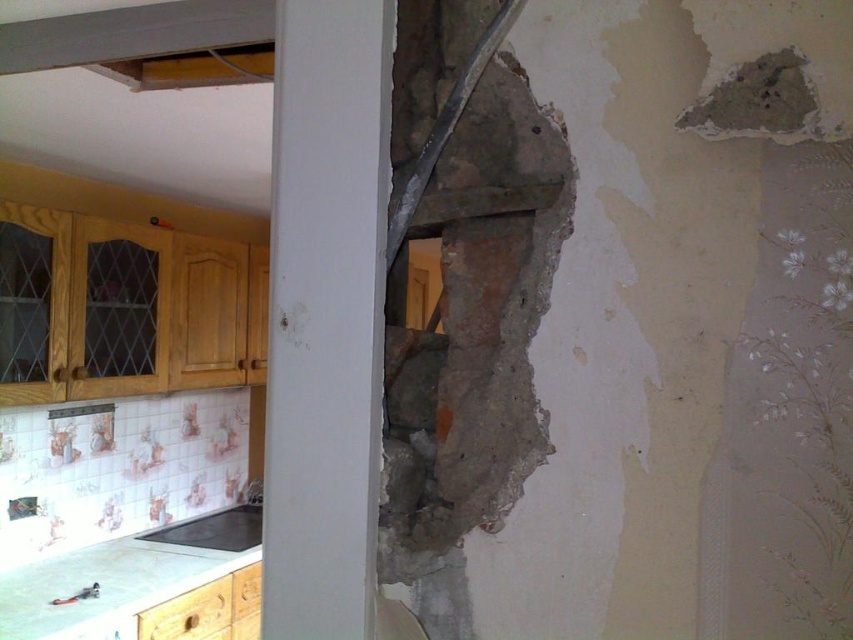
Is white glossy countertop at lower left positioned before black matte stove at lower left?

Yes, white glossy countertop at lower left is closer to the viewer.

Is point (86, 630) behind point (234, 516)?

That is False.

Between point (149, 545) and point (231, 529), which one is positioned behind?

The point (231, 529) is more distant.

At what (x,y) coordinates should I click in order to perform the action: click on white glossy countertop at lower left. Please return your answer as a coordinate pair (x, y). The height and width of the screenshot is (640, 853). Looking at the image, I should click on (144, 586).